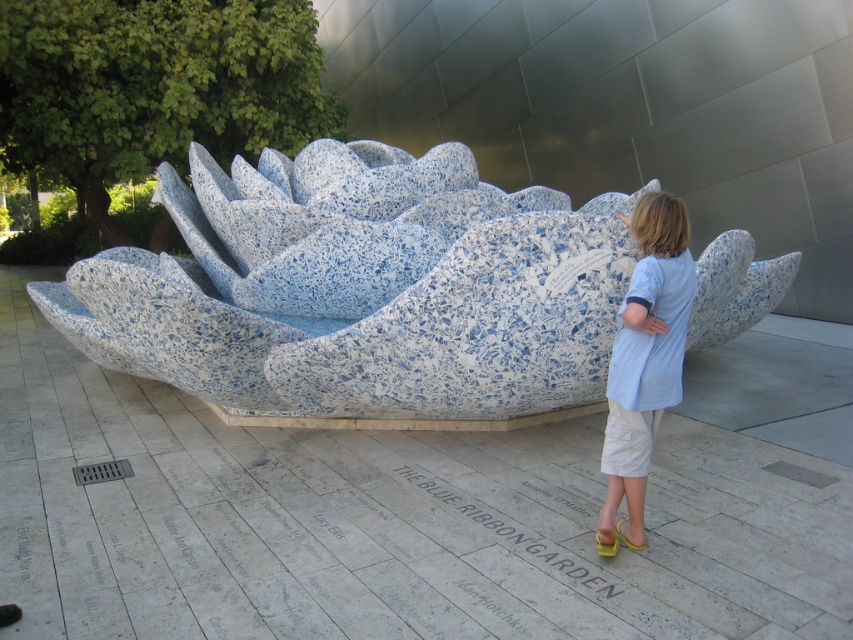
Question: Can you confirm if speckled stone lotus at center is bigger than light blue cotton shirt at center?

Choices:
 (A) yes
 (B) no

Answer: (A)

Question: From the image, what is the correct spatial relationship of speckled stone lotus at center in relation to light blue cotton shirt at center?

Choices:
 (A) left
 (B) right

Answer: (A)

Question: Among these objects, which one is nearest to the camera?

Choices:
 (A) speckled stone lotus at center
 (B) light blue cotton shirt at center

Answer: (B)

Question: Does speckled stone lotus at center have a greater width compared to light blue cotton shirt at center?

Choices:
 (A) yes
 (B) no

Answer: (A)

Question: Among these objects, which one is nearest to the camera?

Choices:
 (A) speckled stone lotus at center
 (B) light blue cotton shirt at center

Answer: (B)